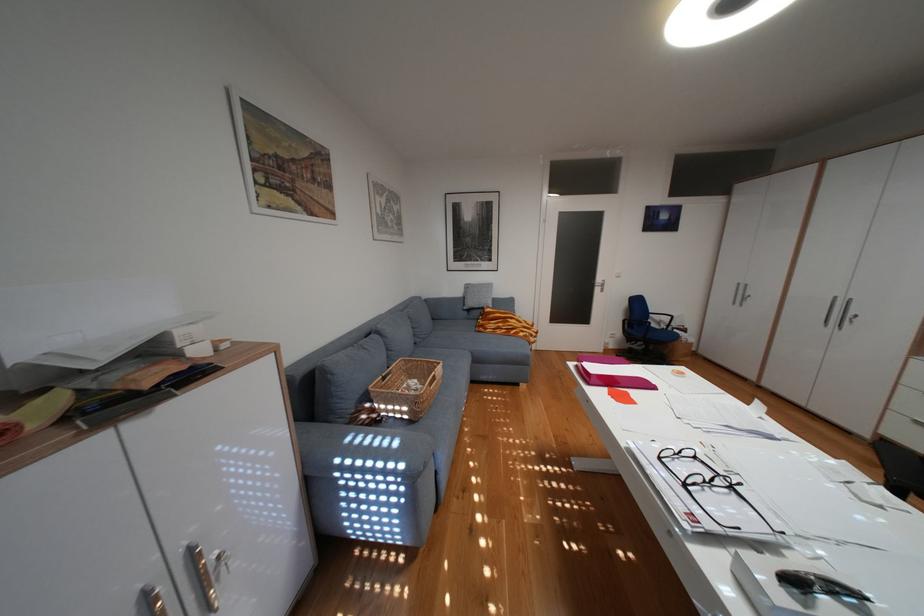
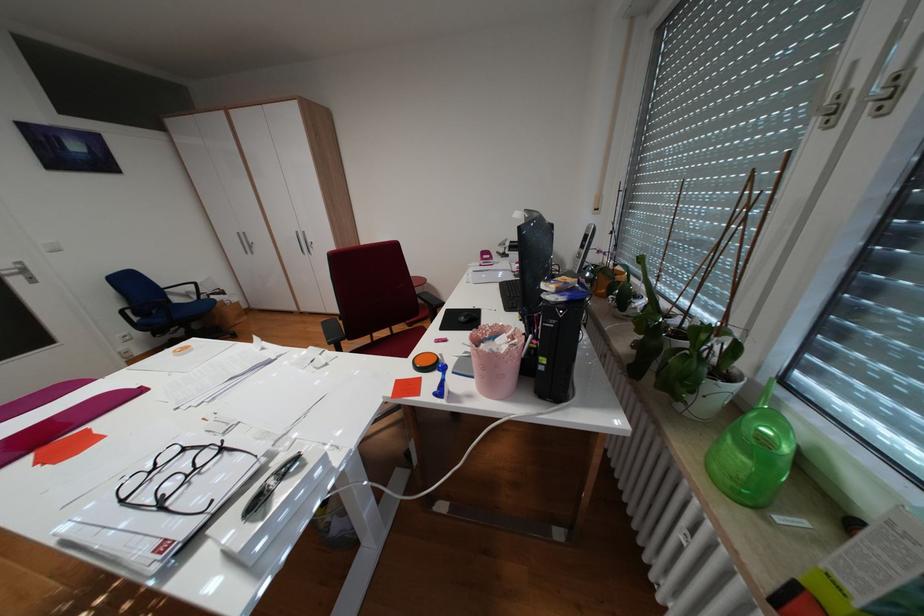
Find the pixel in the second image that matches point 698,485 in the first image.

(173, 505)